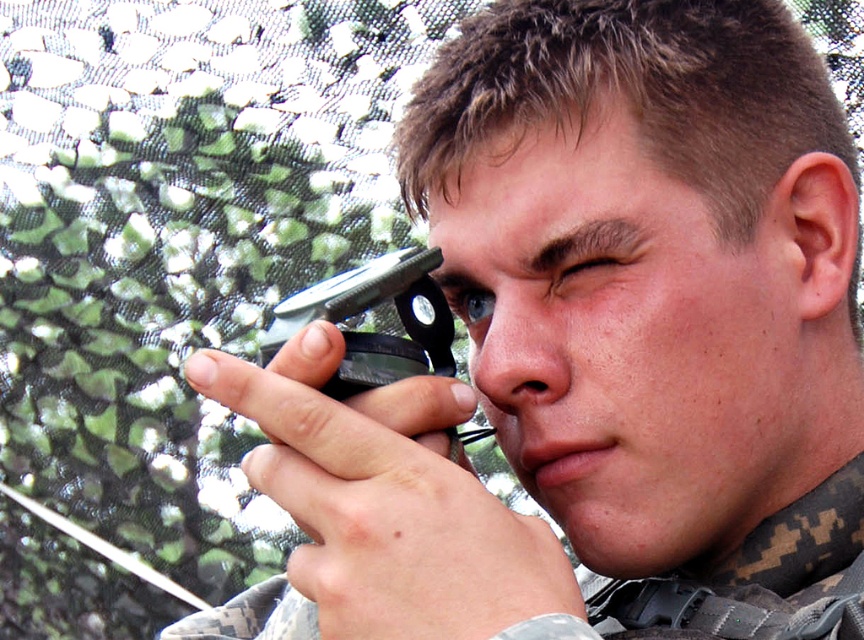
Question: Does camouflage fabric at center appear over pinkish skin ear at right?

Choices:
 (A) yes
 (B) no

Answer: (B)

Question: Is camouflage fabric at center positioned behind pinkish skin ear at right?

Choices:
 (A) no
 (B) yes

Answer: (A)

Question: Which object appears farthest from the camera in this image?

Choices:
 (A) pinkish skin ear at right
 (B) camouflage fabric at center

Answer: (A)

Question: Where is camouflage fabric at center located in relation to pinkish skin ear at right in the image?

Choices:
 (A) right
 (B) left

Answer: (B)